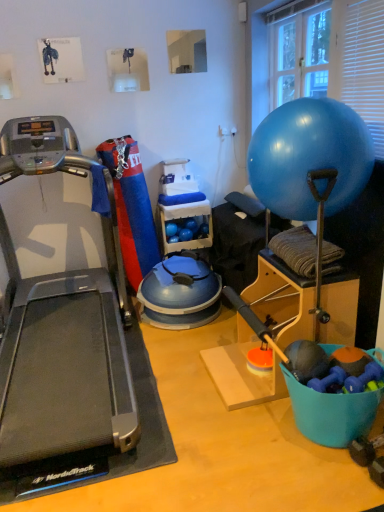
Identify the location of vacant area in front of blue plastic bucket at lower right. (337, 484).